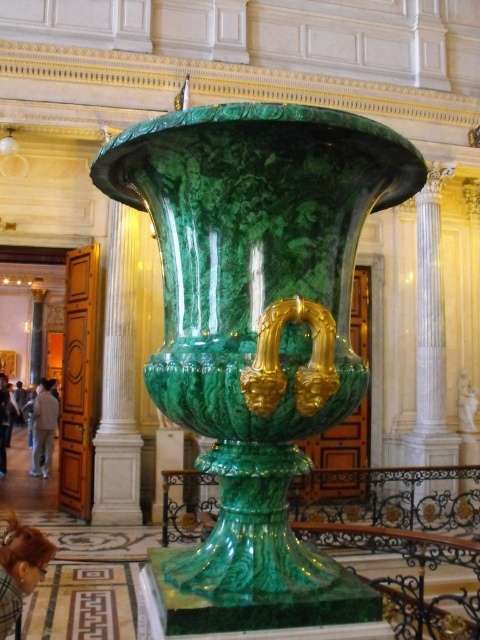
You are an interior designer planning to place a new decorative item in the room. The new item requires a spot at coordinate point exactly at the center of the room, which is at point 0.5, 0.5. The green marble vase at center is currently at point 0.483, 0.535. Can the new item be placed at the exact center without moving the vase?

The green marble vase at center is currently at point (256, 308), which is very close to the center point (240, 320). Since the vase is not exactly at the center coordinates, there is space to place the new item at the exact center without moving the vase.

You are standing in the museum and see two points marked in the image. Which point is closer to you, point (7, 618) or point (48, 388)?

Point (7, 618) is in front of point (48, 388), so it is closer to you.